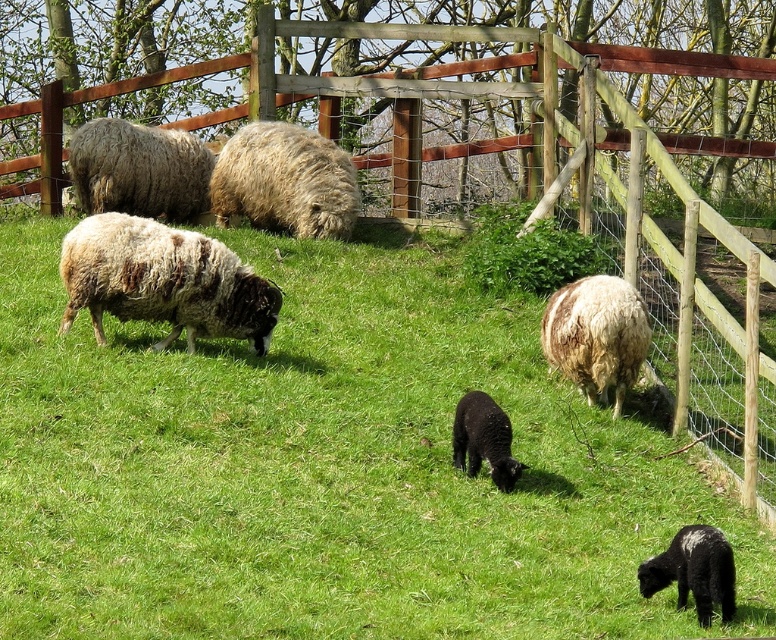
Question: Is fluffy woolen sheep at upper left above black woolly lamb at center?

Choices:
 (A) yes
 (B) no

Answer: (A)

Question: In this image, where is fluffy woolen sheep at upper left located relative to black woolly lamb at center?

Choices:
 (A) below
 (B) above

Answer: (B)

Question: Which of the following is the closest to the observer?

Choices:
 (A) black woolly lamb at lower right
 (B) brown woolen sheep at center
 (C) fluffy woolen sheep at upper left
 (D) fuzzy white sheep at center

Answer: (A)

Question: Does fluffy white wool at upper center have a lesser width compared to brown woolen sheep at center?

Choices:
 (A) no
 (B) yes

Answer: (A)

Question: Which of the following is the closest to the observer?

Choices:
 (A) fluffy white wool at upper center
 (B) fluffy woolen sheep at upper left

Answer: (A)

Question: Estimate the real-world distances between objects in this image. Which object is farther from the fuzzy white sheep at center?

Choices:
 (A) fluffy white wool at upper center
 (B) brown woolen sheep at center
 (C) black woolly lamb at lower right

Answer: (C)